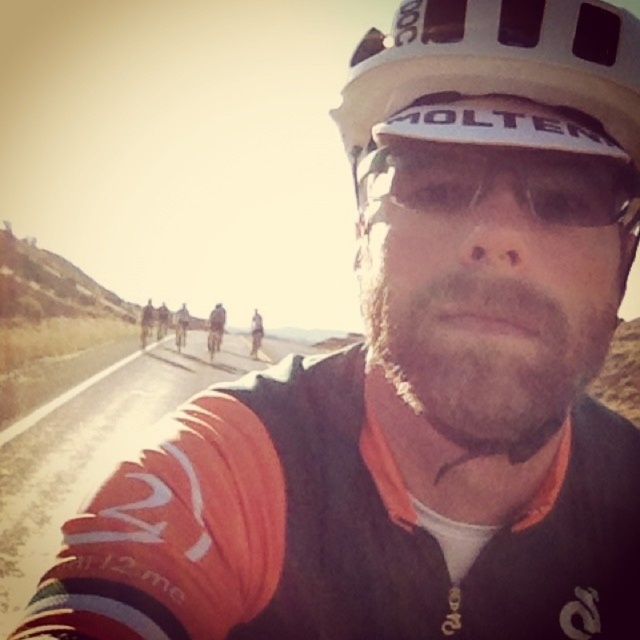
Question: Is white matte helmet at center behind transparent plastic goggles at center?

Choices:
 (A) yes
 (B) no

Answer: (B)

Question: Among these objects, which one is farthest from the camera?

Choices:
 (A) white matte bicycle helmet at center
 (B) dark brown leather jacket at center
 (C) white matte helmet at center

Answer: (B)

Question: Which object is the closest to the white matte bicycle helmet at center?

Choices:
 (A) dark brown leather jacket at center
 (B) white matte helmet at center
 (C) transparent plastic goggles at center

Answer: (B)

Question: From the image, what is the correct spatial relationship of white matte helmet at center in relation to white matte bicycle helmet at center?

Choices:
 (A) below
 (B) above

Answer: (A)

Question: Is transparent plastic goggles at center bigger than dark brown leather jacket at center?

Choices:
 (A) no
 (B) yes

Answer: (A)

Question: Which object is the closest to the dark brown leather jacket at center?

Choices:
 (A) white matte bicycle helmet at center
 (B) transparent plastic goggles at center
 (C) white matte helmet at center

Answer: (A)